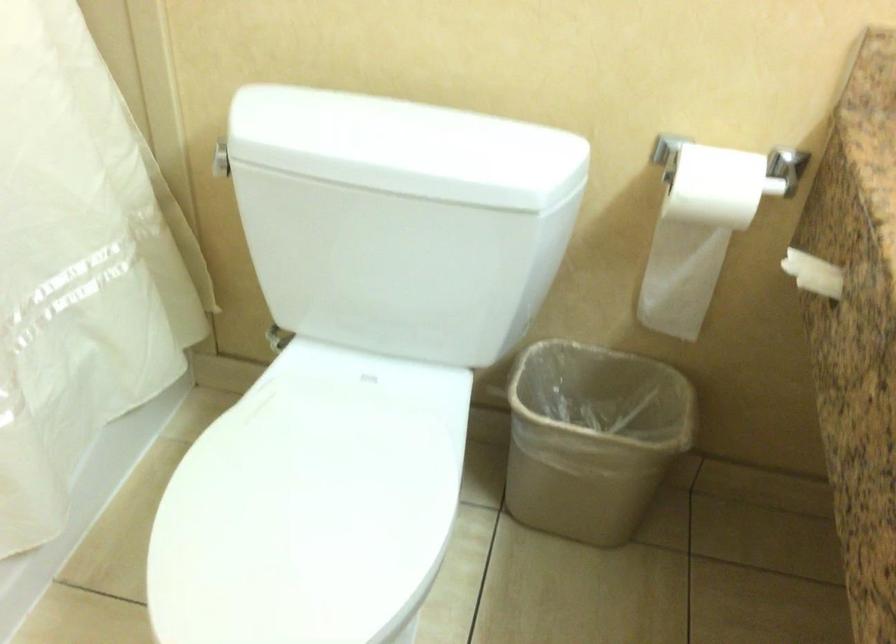
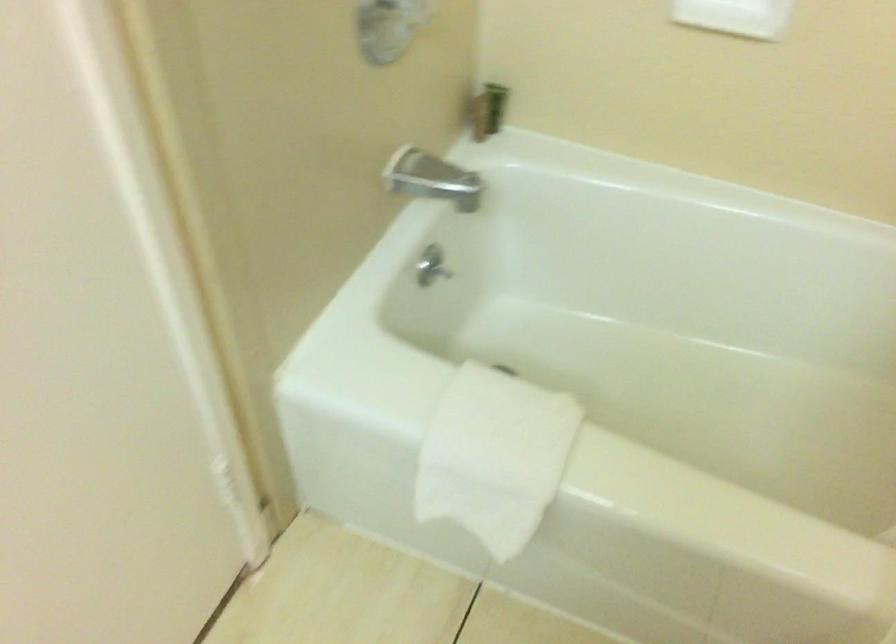
How did the camera likely rotate?

The camera's rotation is toward left-down.